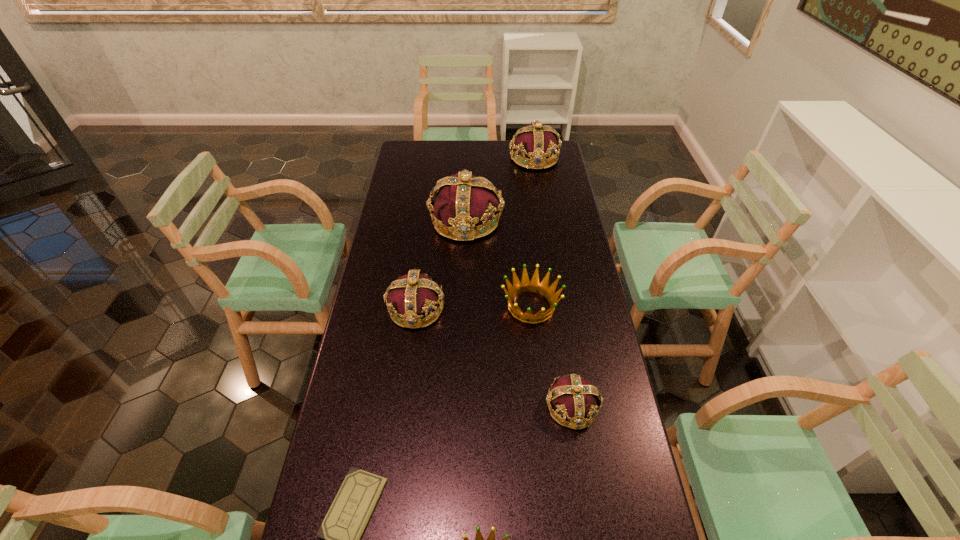
Where is `vacant region between the smallest purple crown and the bigger golden crown`? The height and width of the screenshot is (540, 960). vacant region between the smallest purple crown and the bigger golden crown is located at coordinates (551, 356).

Where is `vacant space in between the farther golden crown and the tallest crown`? Image resolution: width=960 pixels, height=540 pixels. vacant space in between the farther golden crown and the tallest crown is located at coordinates (498, 264).

At what (x,y) coordinates should I click in order to perform the action: click on free space between the second smallest purple crown and the nearest purple crown. Please return your answer as a coordinate pair (x, y). The height and width of the screenshot is (540, 960). Looking at the image, I should click on (493, 357).

Where is `free space between the fifth shortest crown and the bigger golden crown`? free space between the fifth shortest crown and the bigger golden crown is located at coordinates (533, 232).

Find the location of a particular element. free space between the tallest object and the fifth shortest crown is located at coordinates (500, 190).

At what (x,y) coordinates should I click in order to perform the action: click on blank region between the fifth shortest crown and the farther golden crown. Please return your answer as a coordinate pair (x, y). Image resolution: width=960 pixels, height=540 pixels. Looking at the image, I should click on (533, 232).

I want to click on the sixth closest object to the smaller golden crown, so click(x=535, y=142).

Where is `the second closest object relative to the second nearest purple crown`? This screenshot has width=960, height=540. the second closest object relative to the second nearest purple crown is located at coordinates (463, 201).

Where is `crown that is the third closest to the farther golden crown`? The height and width of the screenshot is (540, 960). crown that is the third closest to the farther golden crown is located at coordinates (463, 201).

Locate an element on the screen. The height and width of the screenshot is (540, 960). the third closest crown to the fifth shortest crown is located at coordinates (414, 295).